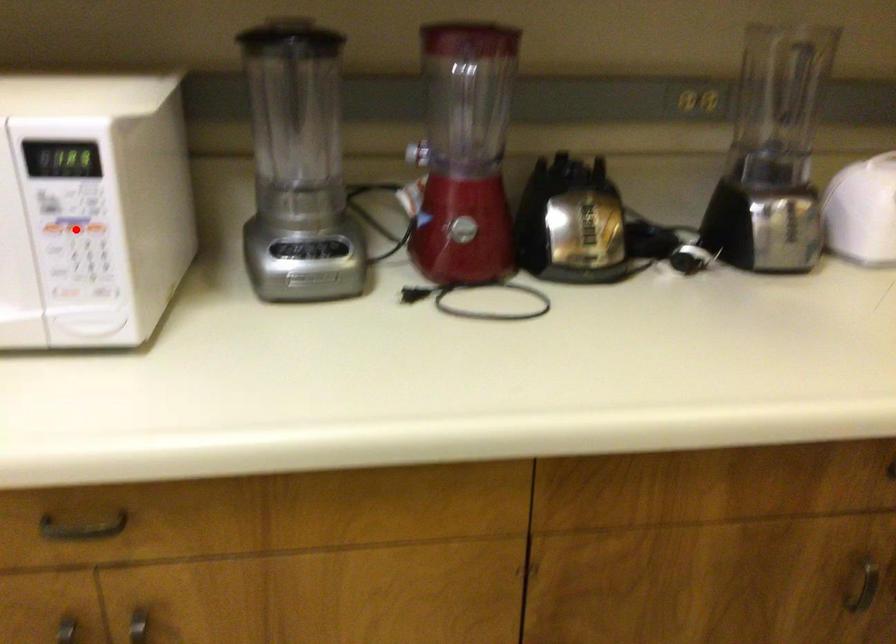
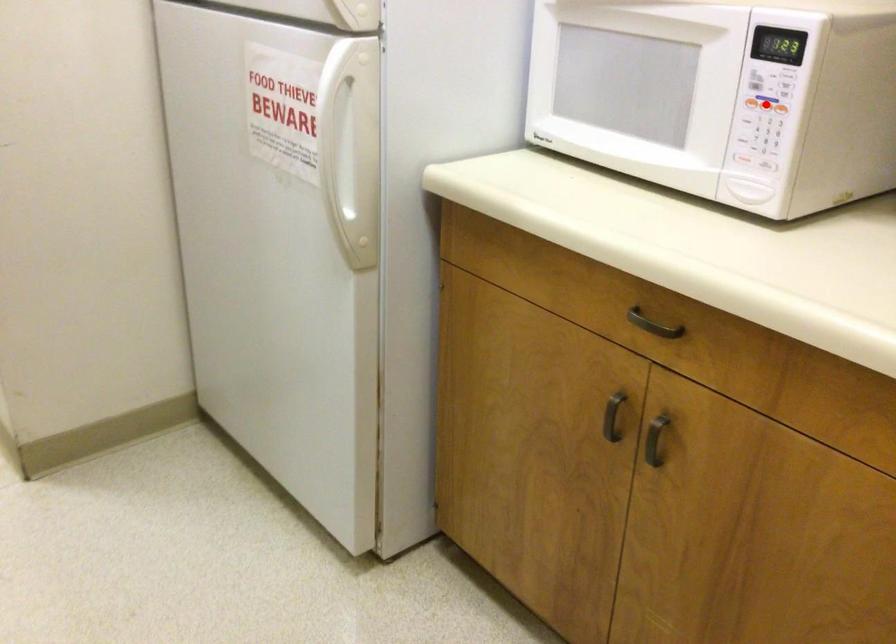
I am providing you with two images of the same scene from different viewpoints. A red point is marked on the first image and another point is marked on the second image. Is the marked point in image1 the same physical position as the marked point in image2?

Yes